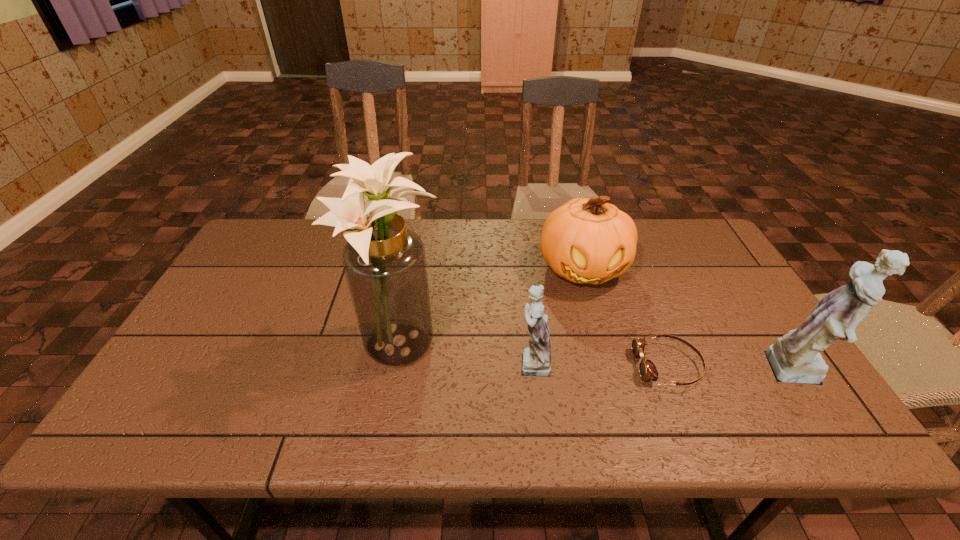
This screenshot has height=540, width=960. Identify the location of vacant area at the far edge. (455, 222).

In the image, there is a desktop. Where is `vacant space at the near edge`? This screenshot has height=540, width=960. vacant space at the near edge is located at coordinates (321, 394).

This screenshot has height=540, width=960. I want to click on vacant space at the left edge of the desktop, so click(x=277, y=275).

At what (x,y) coordinates should I click in order to perform the action: click on vacant space at the far left corner of the desktop. Please return your answer as a coordinate pair (x, y). The image size is (960, 540). Looking at the image, I should click on (249, 252).

In the image, there is a desktop. Where is `vacant area at the near left corner`? vacant area at the near left corner is located at coordinates (186, 372).

At what (x,y) coordinates should I click in order to perform the action: click on free spot at the near right corner of the desktop. Please return your answer as a coordinate pair (x, y). Image resolution: width=960 pixels, height=540 pixels. Looking at the image, I should click on (794, 399).

This screenshot has height=540, width=960. Find the location of `free spot between the goggles and the rightmost object`. free spot between the goggles and the rightmost object is located at coordinates (735, 369).

Where is `unoccupied position between the shortest object and the shorter figurine`? unoccupied position between the shortest object and the shorter figurine is located at coordinates (600, 364).

Locate an element on the screen. vacant space that's between the shorter figurine and the second tallest object is located at coordinates (666, 368).

What are the coordinates of `free point between the shortest object and the left figurine` in the screenshot? It's located at (600, 364).